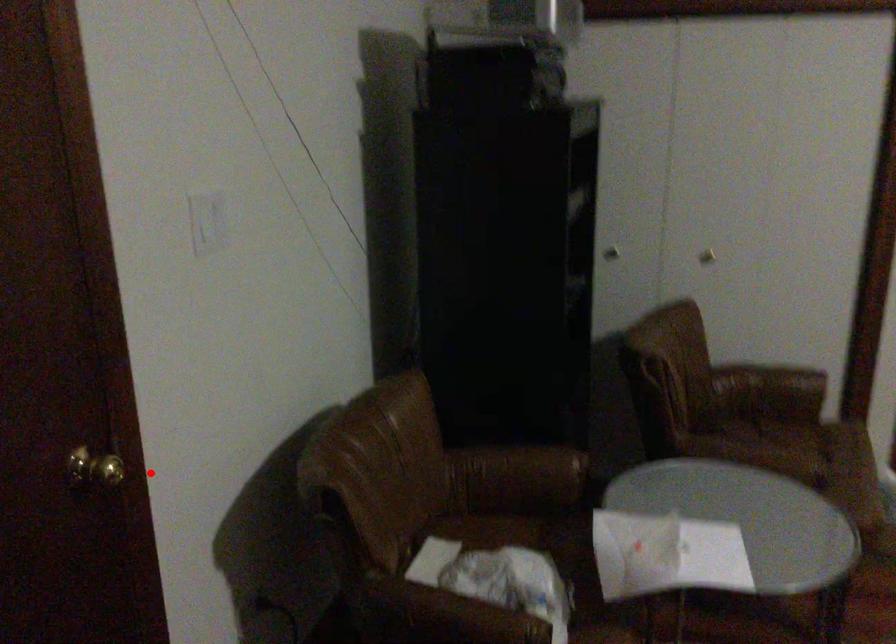
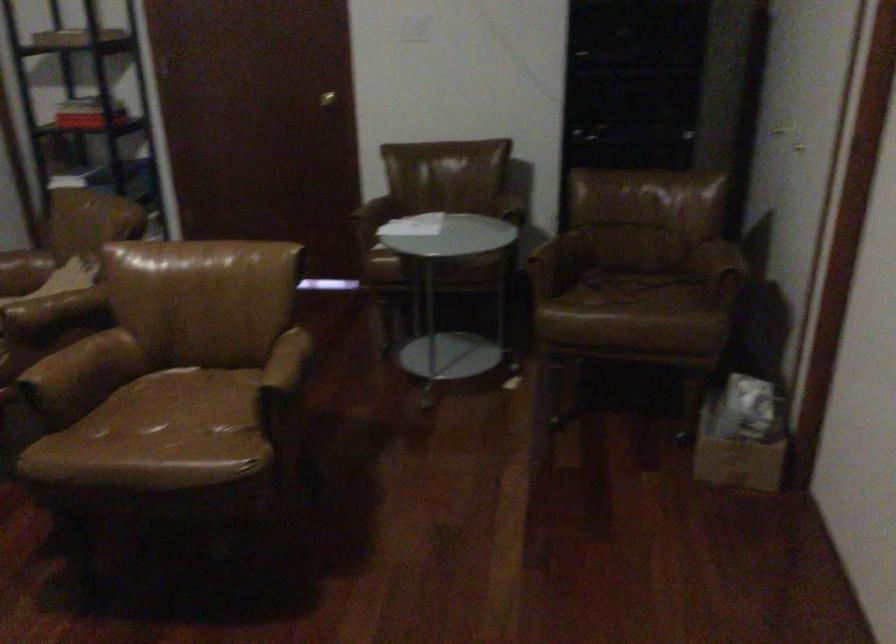
Find the pixel in the second image that matches the highlighted location in the first image.

(326, 99)